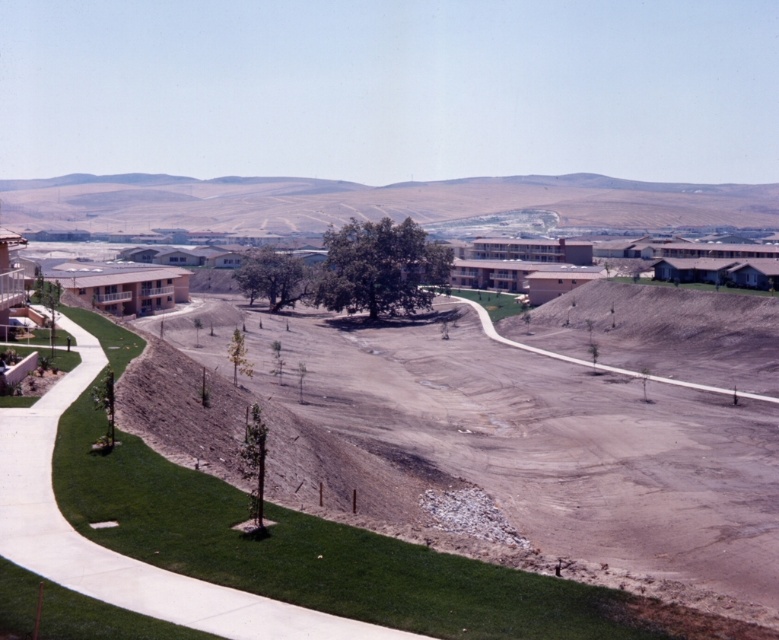
In the scene shown: Based on the scene described, where is the brown dirt hillside at center located in terms of coordinates?

The brown dirt hillside at center is located at point coordinates of [372,202].